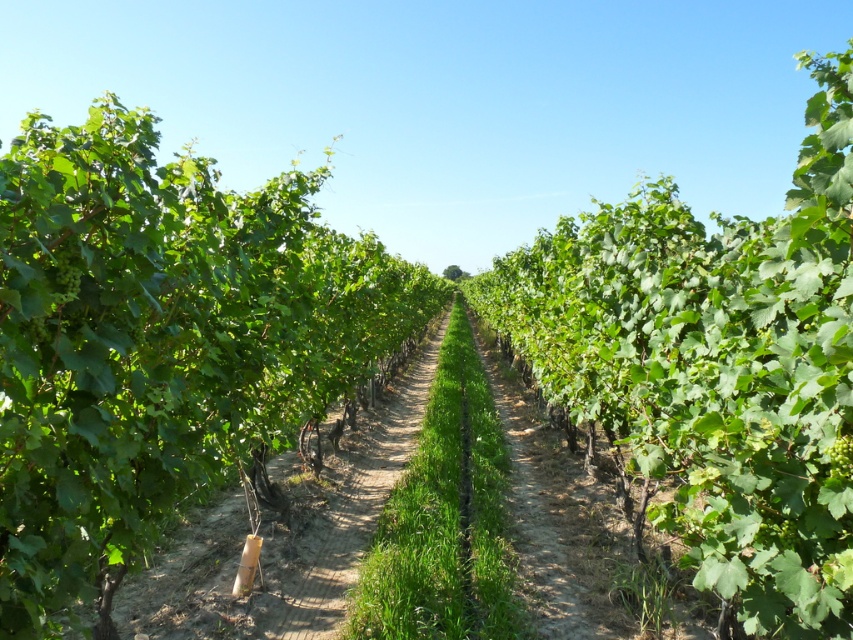
You are a gardener standing at the entrance of the vineyard. You see the green grass at center and the green matte grape at center. Which object is located to the left when facing towards the center of the vineyard?

The green grass at center is positioned on the left side of the green matte grape at center, so the green grass at center is to the left when facing towards the center of the vineyard.